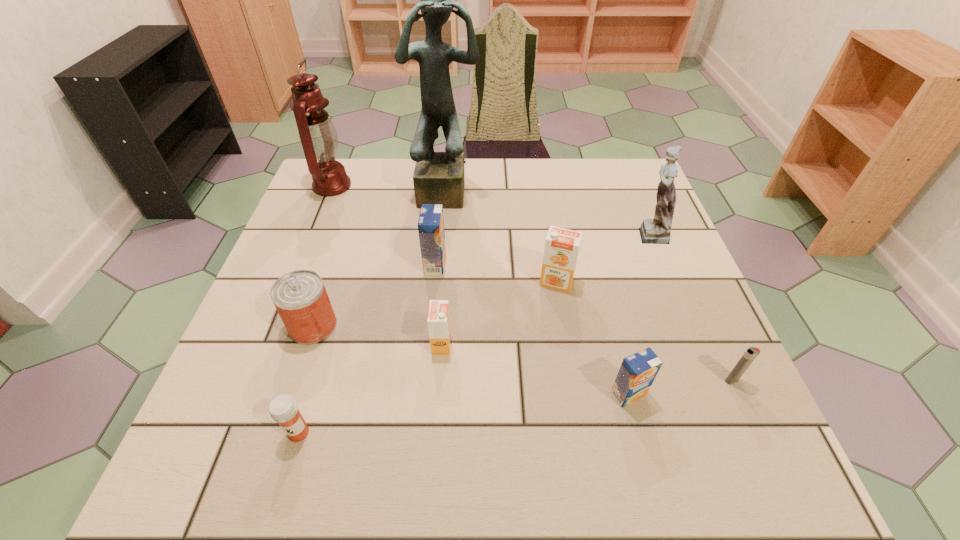
At what (x,y) coordinates should I click in order to perform the action: click on sculpture. Please return your answer as a coordinate pair (x, y). Looking at the image, I should click on (438, 178).

Image resolution: width=960 pixels, height=540 pixels. In order to click on gray sculpture in this screenshot , I will do `click(438, 178)`.

This screenshot has height=540, width=960. I want to click on red oil lamp, so click(318, 136).

Locate an element on the screen. The width and height of the screenshot is (960, 540). the second tallest object is located at coordinates (318, 136).

Locate an element on the screen. This screenshot has height=540, width=960. the third farthest object is located at coordinates (658, 230).

This screenshot has width=960, height=540. I want to click on figurine, so click(x=658, y=230).

Locate an element on the screen. the left blue orange_juice is located at coordinates (431, 223).

This screenshot has height=540, width=960. What are the coordinates of `the bigger blue orange_juice` in the screenshot? It's located at (431, 223).

Locate an element on the screen. This screenshot has width=960, height=540. the right orange orange juice is located at coordinates tap(562, 245).

What are the coordinates of `the fourth object from right to left` in the screenshot? It's located at (562, 245).